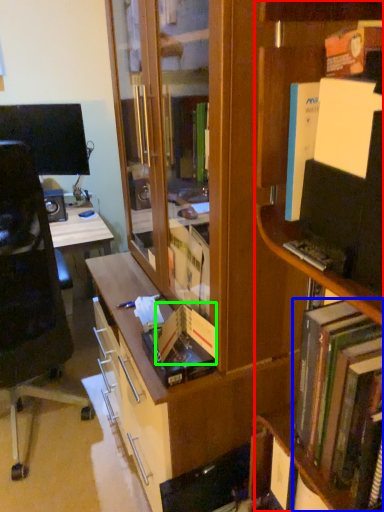
Question: Estimate the real-world distances between objects in this image. Which object is closer to shelf (highlighted by a red box), book (highlighted by a blue box) or paperback book (highlighted by a green box)?

Choices:
 (A) book
 (B) paperback book

Answer: (A)